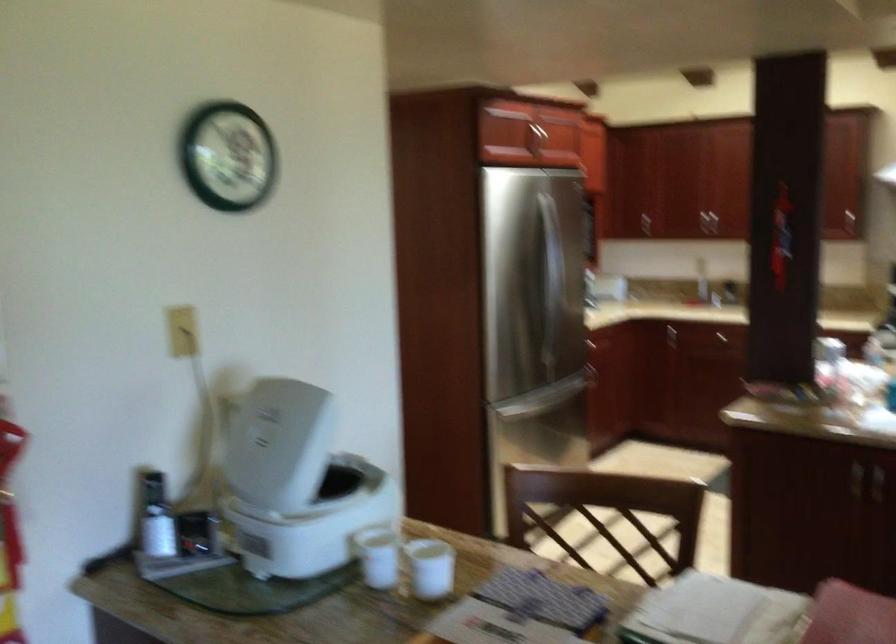
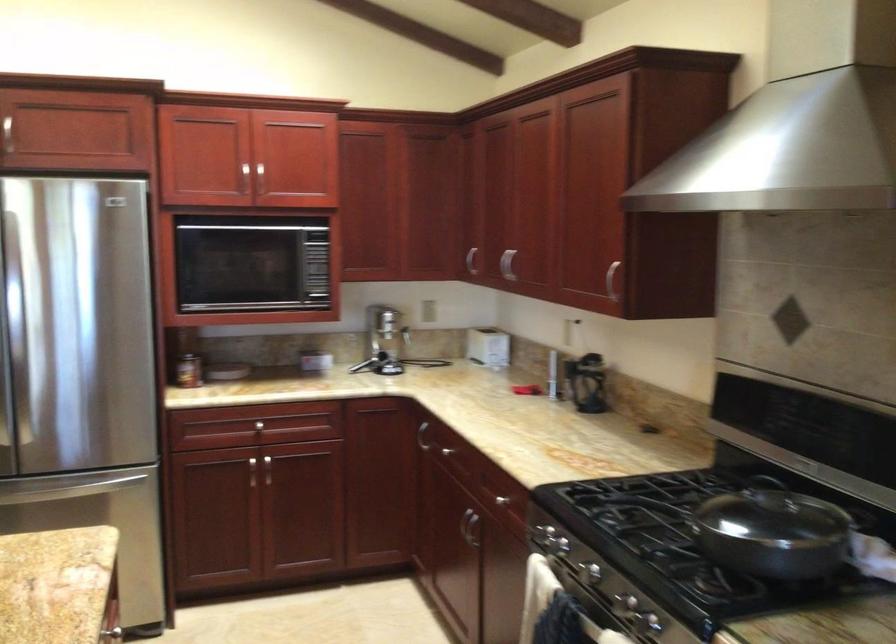
The point at (647, 319) is marked in the first image. Where is the corresponding point in the second image?

(421, 436)